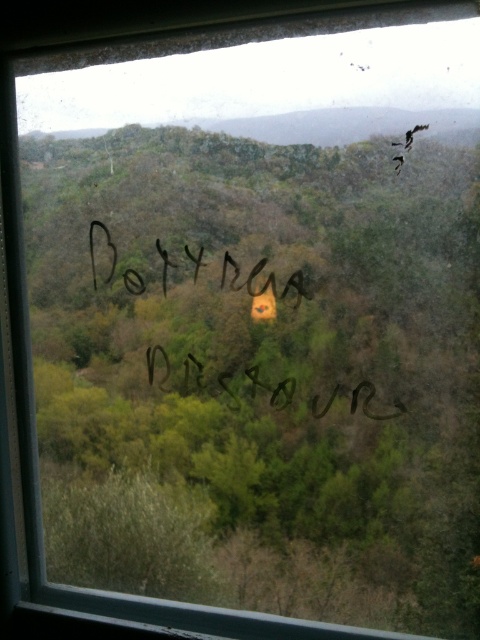
Question: Is black ink writing at center in front of black marker writing at center?

Choices:
 (A) no
 (B) yes

Answer: (B)

Question: Which object is closer to the camera taking this photo?

Choices:
 (A) black marker writing at center
 (B) black ink writing at center

Answer: (B)

Question: Observing the image, what is the correct spatial positioning of black ink writing at center in reference to black marker writing at center?

Choices:
 (A) left
 (B) right

Answer: (B)

Question: Does black ink writing at center have a greater width compared to black marker writing at center?

Choices:
 (A) yes
 (B) no

Answer: (A)